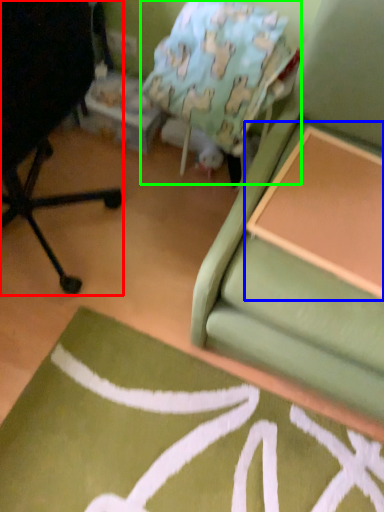
Question: Estimate the real-world distances between objects in this image. Which object is closer to chair (highlighted by a red box), table (highlighted by a blue box) or bean bag chair (highlighted by a green box)?

Choices:
 (A) table
 (B) bean bag chair

Answer: (B)